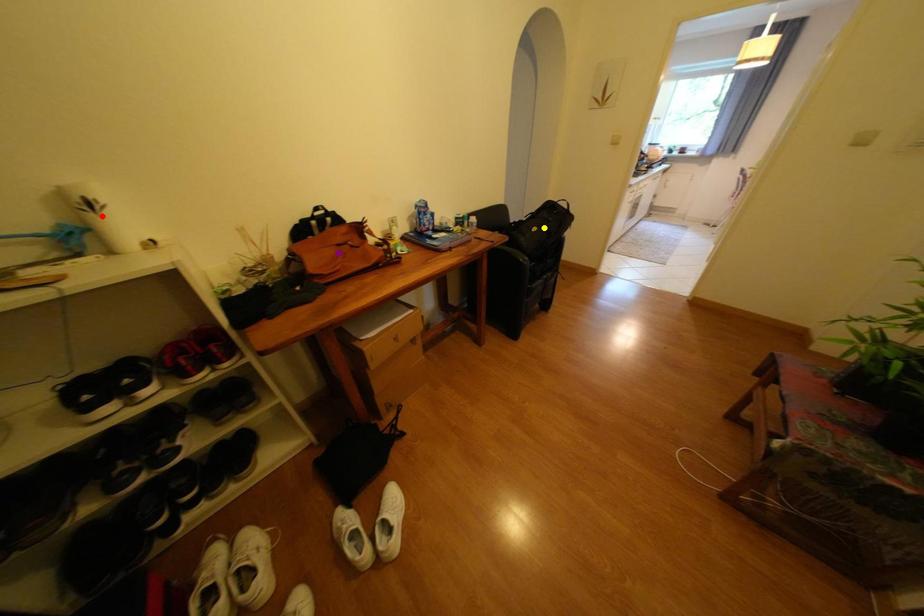
Order these from nearest to farthest:
purple point, red point, yellow point

red point, purple point, yellow point